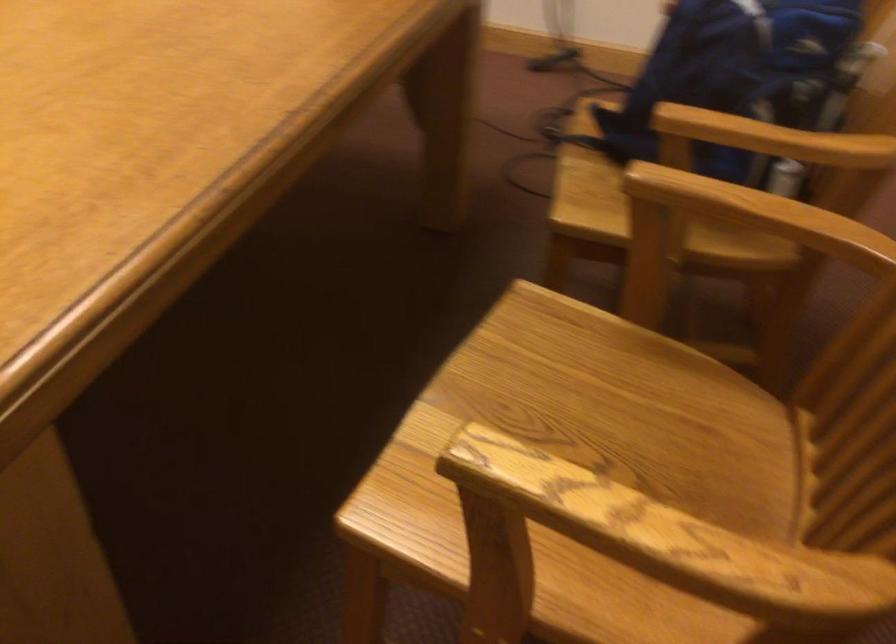
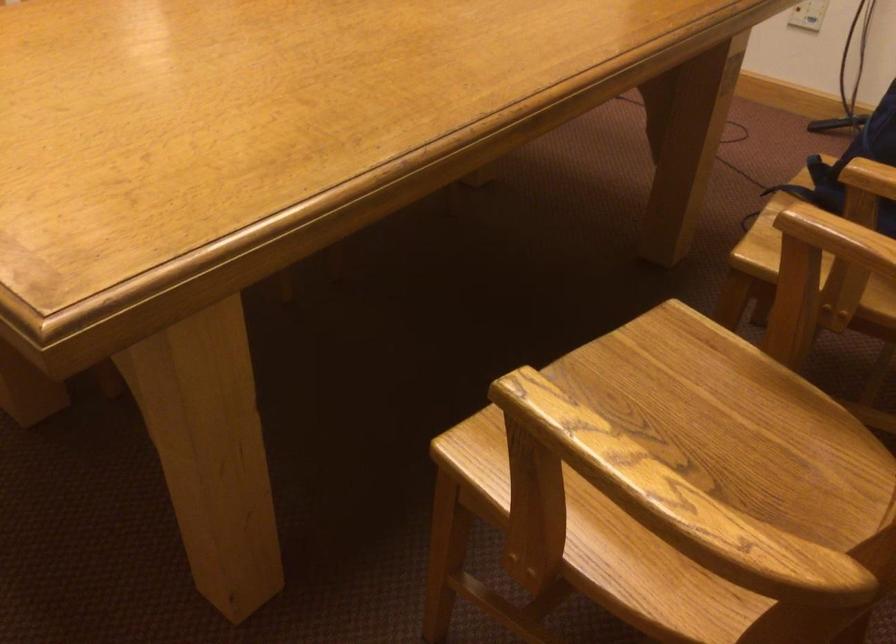
The images are taken continuously from a first-person perspective. In which direction are you moving?

The cameraman walked toward right, backward.